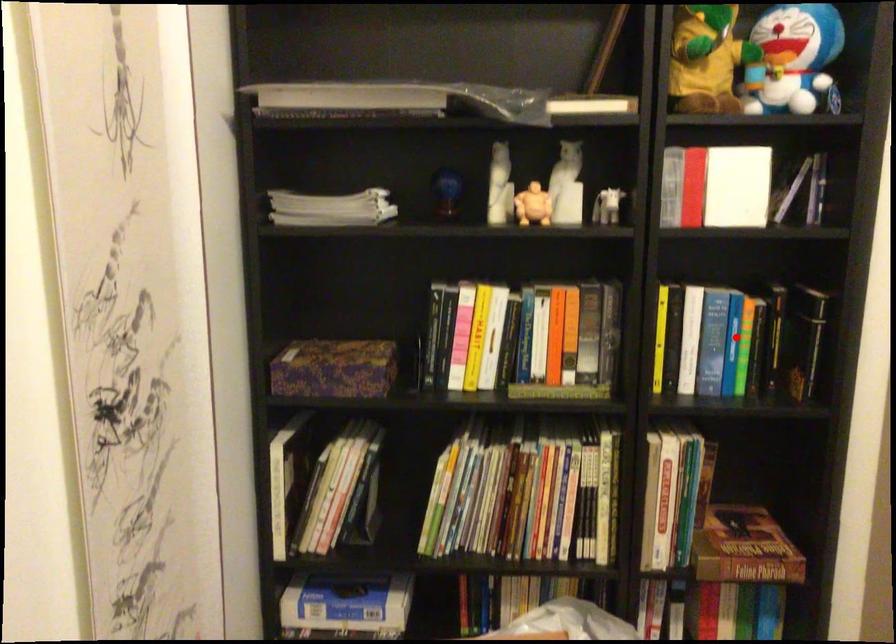
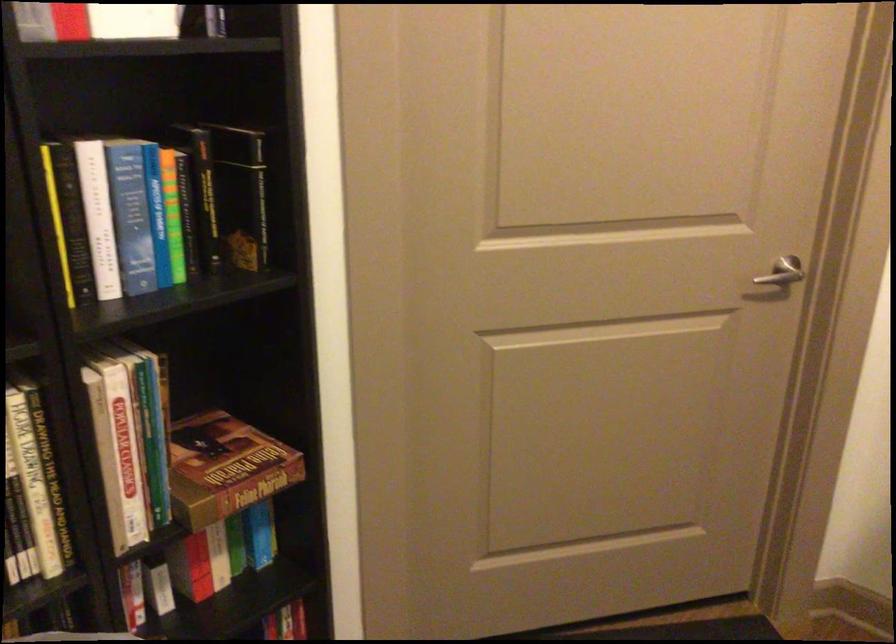
Locate, in the second image, the point that corresponds to the highlighted location in the first image.

(156, 214)